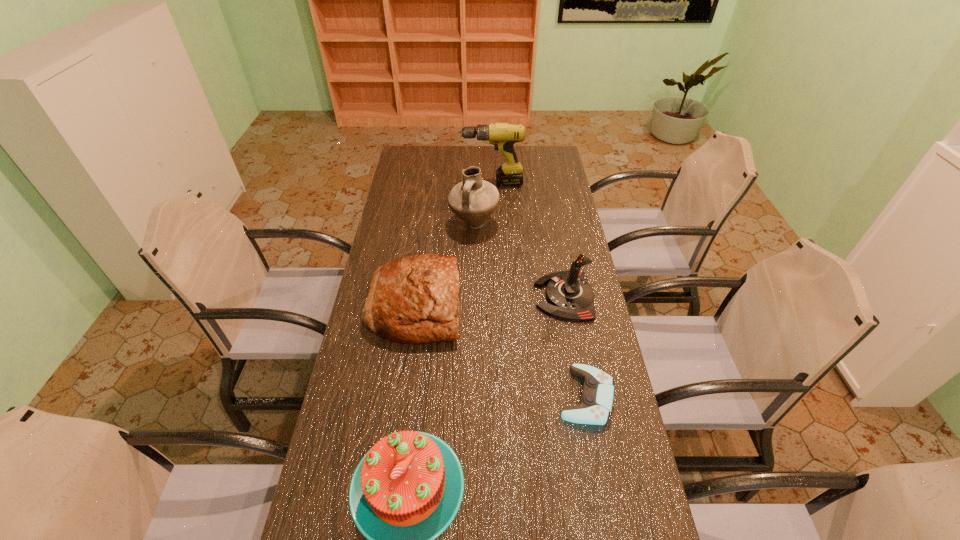
Find the location of a particular element. object identified as the second closest to the fifth farthest object is located at coordinates (407, 489).

Find the location of a particular element. vacant space that satisfies the following two spatial constraints: 1. on the handle side of the fifth nearest object; 2. at the sliced front of the bread is located at coordinates (472, 306).

The image size is (960, 540). I want to click on vacant region that satisfies the following two spatial constraints: 1. on the handle side of the joystick; 2. on the right side of the control, so click(583, 396).